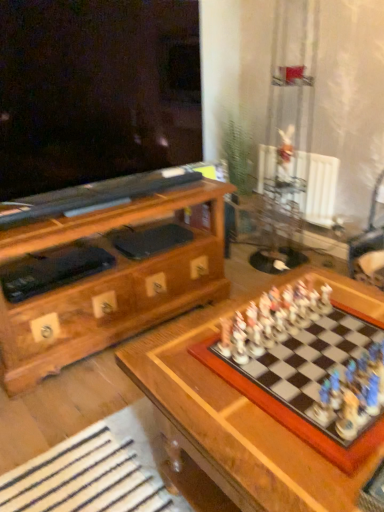
Question: Is wooden chessboard at center at the left side of metallic silver swivel chair at right?

Choices:
 (A) no
 (B) yes

Answer: (B)

Question: Can we say wooden chessboard at center lies outside metallic silver swivel chair at right?

Choices:
 (A) yes
 (B) no

Answer: (A)

Question: Can you confirm if wooden chessboard at center is smaller than metallic silver swivel chair at right?

Choices:
 (A) yes
 (B) no

Answer: (B)

Question: Is metallic silver swivel chair at right at the back of wooden chessboard at center?

Choices:
 (A) yes
 (B) no

Answer: (A)

Question: Does wooden chessboard at center lie behind metallic silver swivel chair at right?

Choices:
 (A) yes
 (B) no

Answer: (B)

Question: From the image's perspective, is wooden chessboard at center above metallic silver swivel chair at right?

Choices:
 (A) no
 (B) yes

Answer: (A)

Question: Is white plastic radiator at upper right wider than metallic silver swivel chair at right?

Choices:
 (A) yes
 (B) no

Answer: (B)

Question: Does white plastic radiator at upper right appear on the right side of metallic silver swivel chair at right?

Choices:
 (A) no
 (B) yes

Answer: (A)

Question: Is white plastic radiator at upper right touching metallic silver swivel chair at right?

Choices:
 (A) no
 (B) yes

Answer: (A)

Question: Would you say white plastic radiator at upper right is a long distance from metallic silver swivel chair at right?

Choices:
 (A) no
 (B) yes

Answer: (A)

Question: From the image's perspective, does white plastic radiator at upper right appear lower than metallic silver swivel chair at right?

Choices:
 (A) yes
 (B) no

Answer: (B)

Question: Is white plastic radiator at upper right not within metallic silver swivel chair at right?

Choices:
 (A) yes
 (B) no

Answer: (A)

Question: From a real-world perspective, is metallic silver swivel chair at right on wooden chessboard at center?

Choices:
 (A) no
 (B) yes

Answer: (B)